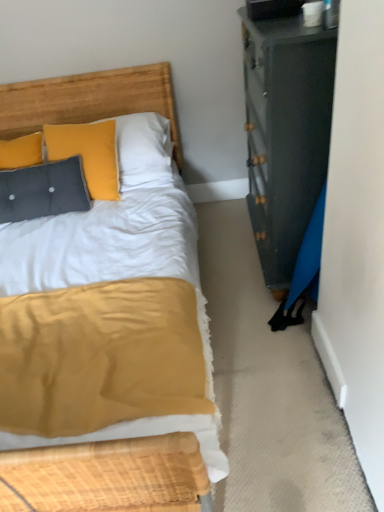
Question: Should I look upward or downward to see textured gray pillow at upper left?

Choices:
 (A) up
 (B) down

Answer: (A)

Question: Can you confirm if textured gray pillow at upper left is taller than wooden headboard at upper left?

Choices:
 (A) no
 (B) yes

Answer: (A)

Question: Is textured gray pillow at upper left positioned in front of wooden headboard at upper left?

Choices:
 (A) no
 (B) yes

Answer: (A)

Question: From the image's perspective, is textured gray pillow at upper left located above wooden headboard at upper left?

Choices:
 (A) no
 (B) yes

Answer: (A)

Question: Are textured gray pillow at upper left and wooden headboard at upper left located far from each other?

Choices:
 (A) no
 (B) yes

Answer: (A)

Question: Does textured gray pillow at upper left appear on the left side of wooden headboard at upper left?

Choices:
 (A) yes
 (B) no

Answer: (A)

Question: Considering the relative positions of textured gray pillow at upper left and wooden headboard at upper left in the image provided, is textured gray pillow at upper left behind wooden headboard at upper left?

Choices:
 (A) yes
 (B) no

Answer: (A)

Question: Is wooden headboard at upper left looking in the opposite direction of textured gray pillow at upper left?

Choices:
 (A) no
 (B) yes

Answer: (A)

Question: Is wooden headboard at upper left closer to the viewer compared to textured gray pillow at upper left?

Choices:
 (A) yes
 (B) no

Answer: (A)

Question: From the image's perspective, would you say wooden headboard at upper left is positioned over textured gray pillow at upper left?

Choices:
 (A) no
 (B) yes

Answer: (B)

Question: Is wooden headboard at upper left bigger than textured gray pillow at upper left?

Choices:
 (A) no
 (B) yes

Answer: (B)

Question: Is wooden headboard at upper left smaller than textured gray pillow at upper left?

Choices:
 (A) no
 (B) yes

Answer: (A)

Question: Is wooden headboard at upper left next to textured gray pillow at upper left?

Choices:
 (A) no
 (B) yes

Answer: (A)

Question: From a real-world perspective, is wooden headboard at upper left above or below textured gray pillow at upper left?

Choices:
 (A) above
 (B) below

Answer: (A)